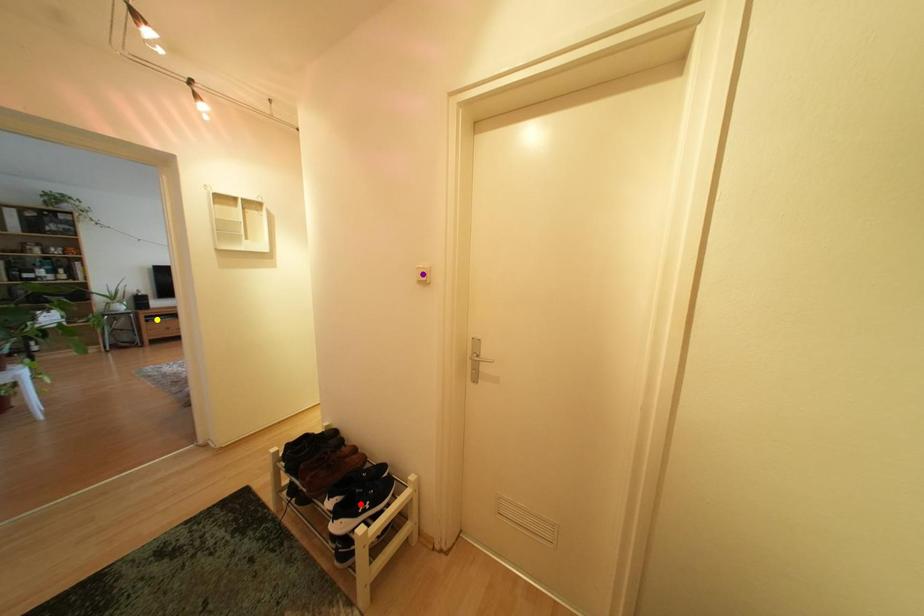
Order these from nearest to farthest:
A) yellow point
B) red point
C) purple point

purple point → red point → yellow point